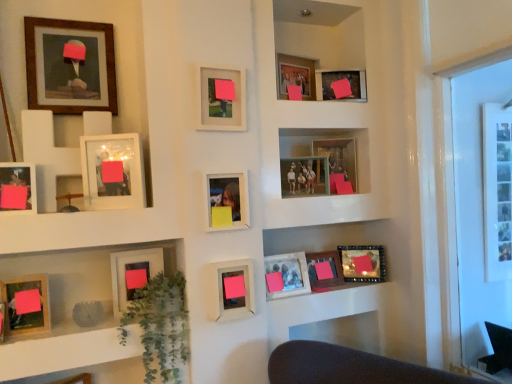
Question: Are wooden framed portrait at upper left, which is the third picture frame from left to right, and wooden photo frame at upper center, the fourteenth picture frame viewed from the left, making contact?

Choices:
 (A) no
 (B) yes

Answer: (A)

Question: Is the depth of wooden framed portrait at upper left, which is the third picture frame from left to right, less than that of wooden photo frame at upper center, which ranks as the second picture frame in right-to-left order?

Choices:
 (A) no
 (B) yes

Answer: (B)

Question: Does wooden framed portrait at upper left, the 13th picture frame when ordered from right to left, have a lesser width compared to wooden photo frame at upper center, which ranks as the second picture frame in right-to-left order?

Choices:
 (A) yes
 (B) no

Answer: (A)

Question: From a real-world perspective, does wooden framed portrait at upper left, which is the third picture frame from left to right, stand above wooden photo frame at upper center, which ranks as the second picture frame in right-to-left order?

Choices:
 (A) no
 (B) yes

Answer: (B)

Question: Is wooden framed portrait at upper left, which is the third picture frame from left to right, far away from wooden photo frame at upper center, which ranks as the second picture frame in right-to-left order?

Choices:
 (A) no
 (B) yes

Answer: (B)

Question: Is wooden framed portrait at upper left, which is the third picture frame from left to right, at the right side of wooden photo frame at upper center, the fourteenth picture frame viewed from the left?

Choices:
 (A) yes
 (B) no

Answer: (B)

Question: Does matte glass picture frame at lower right, positioned as the 15th picture frame in left-to-right order, have a greater height compared to pink matte picture frame at center, which is counted as the tenth picture frame, starting from the right?

Choices:
 (A) no
 (B) yes

Answer: (A)

Question: Considering the relative positions of matte glass picture frame at lower right, positioned as the 15th picture frame in left-to-right order, and pink matte picture frame at center, which is counted as the tenth picture frame, starting from the right, in the image provided, is matte glass picture frame at lower right, positioned as the 15th picture frame in left-to-right order, behind pink matte picture frame at center, which is counted as the tenth picture frame, starting from the right,?

Choices:
 (A) no
 (B) yes

Answer: (B)

Question: Is matte glass picture frame at lower right, positioned as the 15th picture frame in left-to-right order, in contact with pink matte picture frame at center, arranged as the 6th picture frame when viewed from the left?

Choices:
 (A) no
 (B) yes

Answer: (A)

Question: From a real-world perspective, does matte glass picture frame at lower right, the 1th picture frame viewed from the right, sit lower than pink matte picture frame at center, arranged as the 6th picture frame when viewed from the left?

Choices:
 (A) no
 (B) yes

Answer: (B)

Question: Would you say matte glass picture frame at lower right, positioned as the 15th picture frame in left-to-right order, contains pink matte picture frame at center, which is counted as the tenth picture frame, starting from the right?

Choices:
 (A) no
 (B) yes

Answer: (A)

Question: Does matte glass picture frame at lower right, the 1th picture frame viewed from the right, have a lesser width compared to pink matte picture frame at center, arranged as the 6th picture frame when viewed from the left?

Choices:
 (A) no
 (B) yes

Answer: (A)

Question: Is matte wooden picture frame at lower center, the fourth picture frame from the right, oriented towards matte glass picture frame at center, which appears as the seventh picture frame when viewed from the right?

Choices:
 (A) yes
 (B) no

Answer: (B)